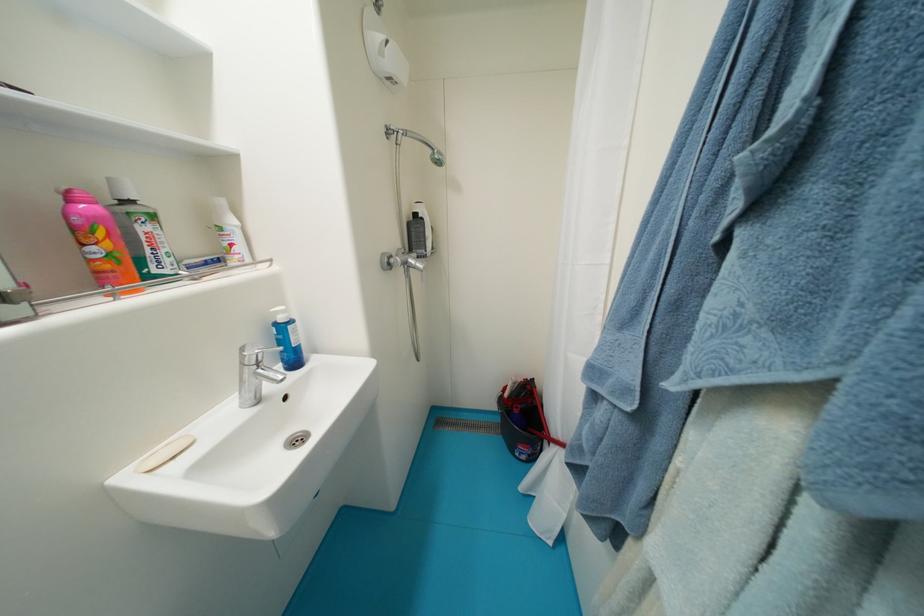
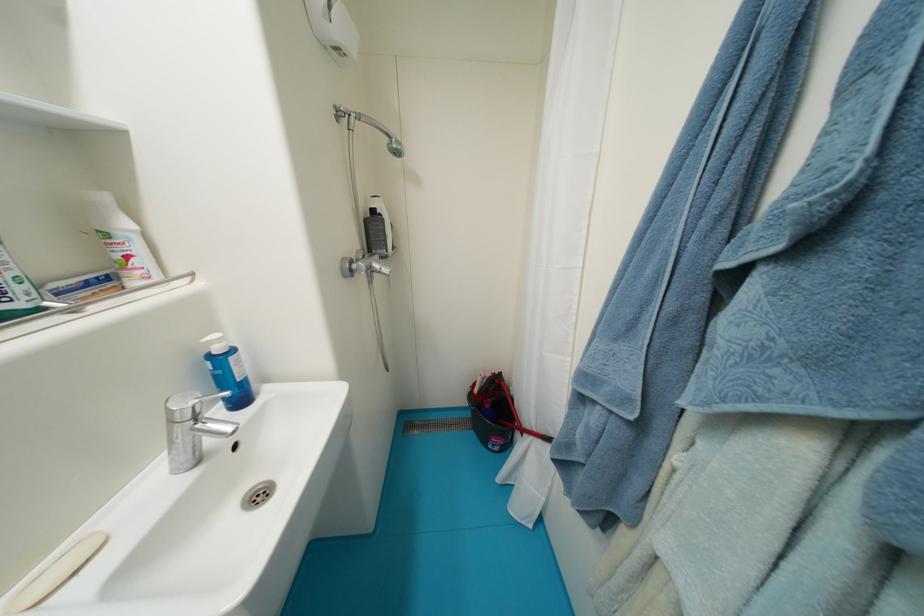
In the second image, find the point that corresponds to (237,246) in the first image.

(134, 259)